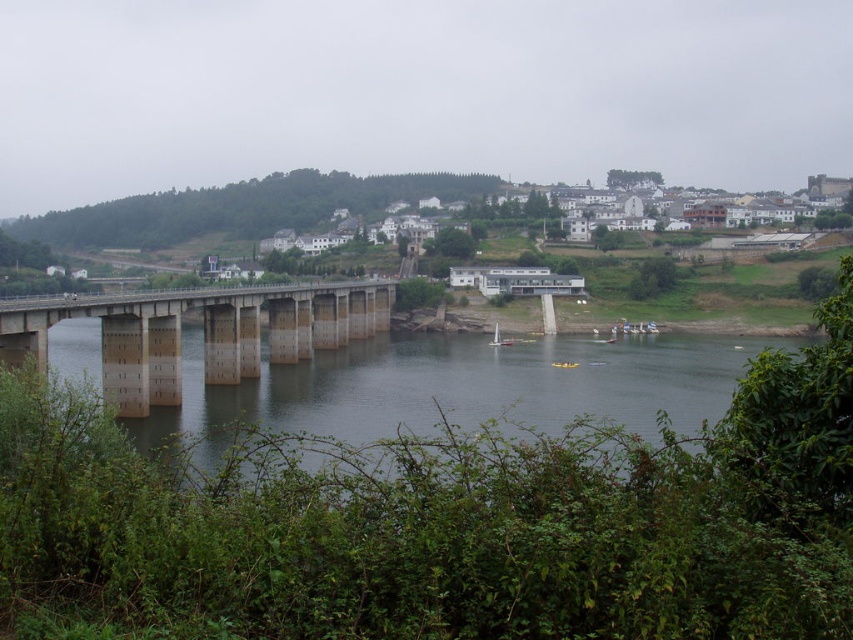
At what (x,y) coordinates should I click in order to perform the action: click on dark gray concrete bridge at center. Please return your answer as a coordinate pair (x, y). This screenshot has height=640, width=853. Looking at the image, I should click on (463, 387).

Is dark gray concrete bridge at center to the left of concrete bridge at center from the viewer's perspective?

In fact, dark gray concrete bridge at center is to the right of concrete bridge at center.

Measure the distance between dark gray concrete bridge at center and camera.

40.50 meters

Find the location of a particular element. This screenshot has height=640, width=853. dark gray concrete bridge at center is located at coordinates (463, 387).